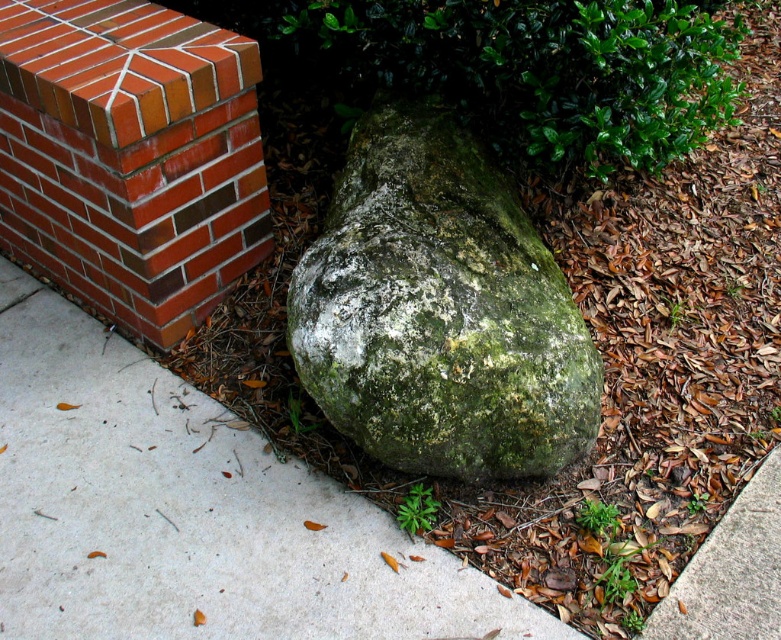
Does point (302, 273) come in front of point (80, 202)?

Yes, it is.

Which is behind, point (459, 134) or point (163, 308)?

Point (459, 134)

Between point (450, 417) and point (166, 100), which one is positioned behind?

Positioned behind is point (166, 100).

Locate an element on the screen. The image size is (781, 640). green mossy rock at center is located at coordinates (439, 310).

Who is taller, gray concrete pavement at center or green mossy rock at center?

green mossy rock at center is taller.

Is gray concrete pavement at center shorter than green mossy rock at center?

Indeed, gray concrete pavement at center has a lesser height compared to green mossy rock at center.

Where is `gray concrete pavement at center`? gray concrete pavement at center is located at coordinates (191, 509).

Between point (9, 285) and point (255, 195), which one is positioned in front?

Point (255, 195)

Which is above, gray concrete pavement at center or red brick at upper left?

red brick at upper left is higher up.

Does point (201, 406) come farther from viewer compared to point (227, 273)?

That is False.

Identify the location of gray concrete pavement at center. The height and width of the screenshot is (640, 781). (191, 509).